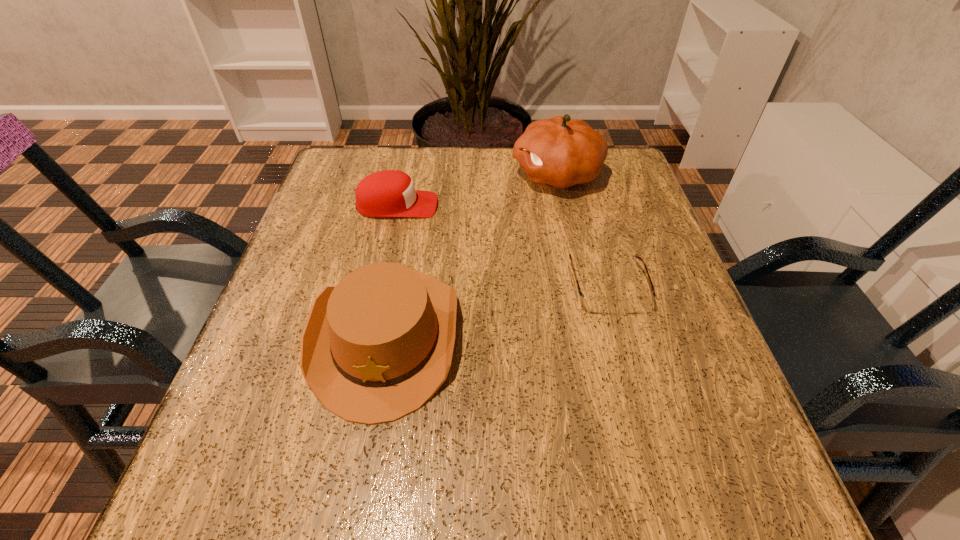
The width and height of the screenshot is (960, 540). Identify the location of free space at the right edge of the desktop. (648, 222).

At what (x,y) coordinates should I click in order to perform the action: click on blank space at the near left corner of the desktop. Please return your answer as a coordinate pair (x, y). The width and height of the screenshot is (960, 540). Looking at the image, I should click on (204, 495).

The image size is (960, 540). I want to click on vacant position at the far right corner of the desktop, so click(597, 181).

This screenshot has width=960, height=540. In the image, there is a desktop. Find the location of `vacant region at the near right corner`. vacant region at the near right corner is located at coordinates (713, 498).

At what (x,y) coordinates should I click in order to perform the action: click on free space between the baseball cap and the pumpkin. Please return your answer as a coordinate pair (x, y). The width and height of the screenshot is (960, 540). Looking at the image, I should click on (477, 190).

Where is `empty space that is in between the second shortest object and the tallest object`? empty space that is in between the second shortest object and the tallest object is located at coordinates coord(477,190).

Where is `vacant space in between the third shortest object and the spectacles`? The width and height of the screenshot is (960, 540). vacant space in between the third shortest object and the spectacles is located at coordinates (496, 312).

Where is `free spot between the spectacles and the third tallest object`? The image size is (960, 540). free spot between the spectacles and the third tallest object is located at coordinates (502, 246).

The image size is (960, 540). I want to click on free spot between the pumpkin and the second tallest object, so click(x=471, y=255).

What are the coordinates of `unoccupied position between the second shortest object and the spectacles` in the screenshot? It's located at (502, 246).